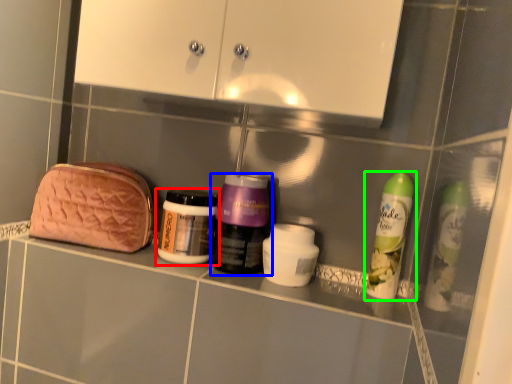
Question: Which object is the farthest from bottle (highlighted by a red box)? Choose among these: bottle (highlighted by a blue box) or bottle (highlighted by a green box).

Choices:
 (A) bottle
 (B) bottle

Answer: (B)